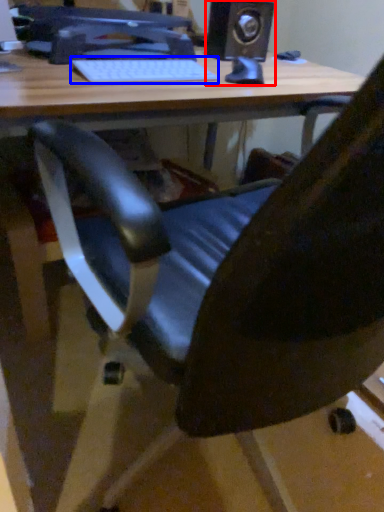
Question: Which object is further to the camera taking this photo, speaker (highlighted by a red box) or laptop keyboard (highlighted by a blue box)?

Choices:
 (A) speaker
 (B) laptop keyboard

Answer: (A)